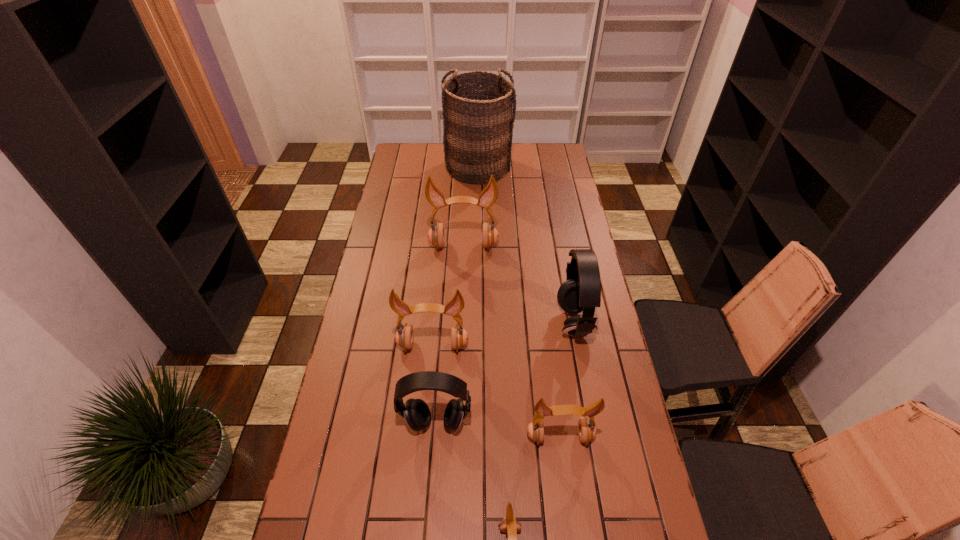
I want to click on the farthest object, so click(x=479, y=107).

Identify the location of brown basket. This screenshot has height=540, width=960. (479, 107).

Find the location of a particular element. The height and width of the screenshot is (540, 960). the sixth shortest object is located at coordinates (436, 235).

This screenshot has width=960, height=540. What are the coordinates of `the biggest brown earphone` in the screenshot? It's located at (436, 235).

Find the location of a particular element. The image size is (960, 540). the third nearest brown earphone is located at coordinates pyautogui.click(x=404, y=336).

Identify the location of the right black earphone. (581, 291).

Where is `the farther black earphone`? The width and height of the screenshot is (960, 540). the farther black earphone is located at coordinates 581,291.

Find the location of a particular element. the third farthest brown earphone is located at coordinates (586, 429).

Locate an element on the screen. The image size is (960, 540). the third biggest brown earphone is located at coordinates (586, 429).

At what (x,y) coordinates should I click in order to perform the action: click on the smaller black earphone. Please return your answer as a coordinate pair (x, y). The height and width of the screenshot is (540, 960). Looking at the image, I should click on (416, 412).